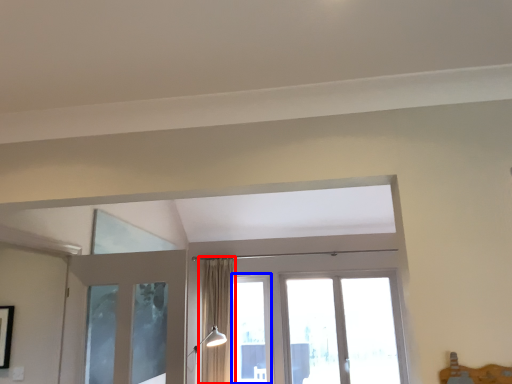
Question: Among these objects, which one is farthest to the camera, curtain (highlighted by a red box) or window (highlighted by a blue box)?

Choices:
 (A) curtain
 (B) window

Answer: (B)